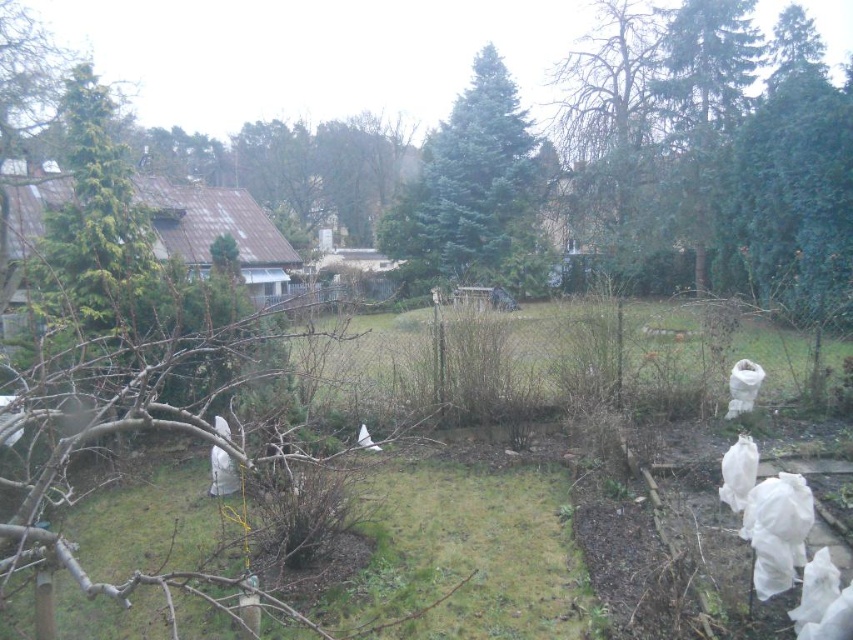
Question: Can you confirm if green matte evergreen tree at center is positioned below green textured tree at upper center?

Choices:
 (A) yes
 (B) no

Answer: (A)

Question: Considering the real-world distances, which object is closest to the green matte evergreen tree at center?

Choices:
 (A) green needle-like tree at upper left
 (B) green textured tree at upper center

Answer: (B)

Question: Can you confirm if green matte evergreen tree at center is positioned above green textured tree at upper center?

Choices:
 (A) no
 (B) yes

Answer: (A)

Question: Can you confirm if green needle-like tree at upper left is thinner than green needle-like tree at upper right?

Choices:
 (A) yes
 (B) no

Answer: (A)

Question: Which of the following is the farthest from the observer?

Choices:
 (A) green needle-like tree at upper left
 (B) green needle-like tree at upper right
 (C) green matte evergreen tree at center

Answer: (C)

Question: Among these objects, which one is nearest to the camera?

Choices:
 (A) green textured tree at upper center
 (B) green needle-like tree at upper left

Answer: (B)